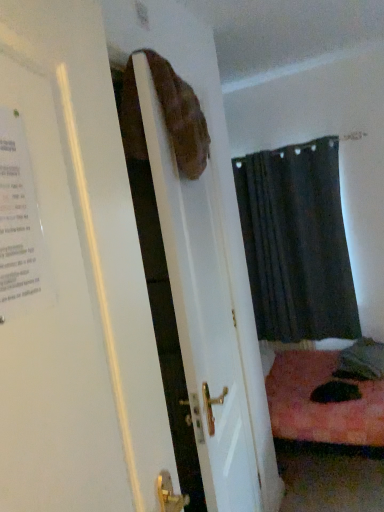
Question: Considering the relative sizes of matte brown bag at upper center and dark fabric curtain at center in the image provided, is matte brown bag at upper center wider than dark fabric curtain at center?

Choices:
 (A) yes
 (B) no

Answer: (B)

Question: Is matte brown bag at upper center positioned with its back to dark fabric curtain at center?

Choices:
 (A) yes
 (B) no

Answer: (B)

Question: From a real-world perspective, is matte brown bag at upper center positioned over dark fabric curtain at center based on gravity?

Choices:
 (A) yes
 (B) no

Answer: (A)

Question: Considering the relative sizes of matte brown bag at upper center and dark fabric curtain at center in the image provided, is matte brown bag at upper center shorter than dark fabric curtain at center?

Choices:
 (A) no
 (B) yes

Answer: (B)

Question: Is matte brown bag at upper center with dark fabric curtain at center?

Choices:
 (A) no
 (B) yes

Answer: (A)

Question: Looking at the image, does matte brown bag at upper center seem bigger or smaller compared to white paper poster at left?

Choices:
 (A) big
 (B) small

Answer: (A)

Question: In the image, is matte brown bag at upper center positioned in front of or behind white paper poster at left?

Choices:
 (A) front
 (B) behind

Answer: (A)

Question: Is matte brown bag at upper center taller or shorter than white paper poster at left?

Choices:
 (A) tall
 (B) short

Answer: (A)

Question: Is point (94, 506) closer or farther from the camera than point (13, 292)?

Choices:
 (A) farther
 (B) closer

Answer: (A)

Question: Visually, is dark fabric curtain at center positioned to the left or to the right of white paper poster at left?

Choices:
 (A) right
 (B) left

Answer: (A)

Question: From their relative heights in the image, would you say dark fabric curtain at center is taller or shorter than white paper poster at left?

Choices:
 (A) short
 (B) tall

Answer: (B)

Question: Considering the positions of dark fabric curtain at center and white paper poster at left in the image, is dark fabric curtain at center bigger or smaller than white paper poster at left?

Choices:
 (A) small
 (B) big

Answer: (B)

Question: Is dark fabric curtain at center inside or outside of white paper poster at left?

Choices:
 (A) outside
 (B) inside

Answer: (A)

Question: Considering the positions of matte brown bag at upper center and dark fabric curtain at center in the image, is matte brown bag at upper center taller or shorter than dark fabric curtain at center?

Choices:
 (A) short
 (B) tall

Answer: (A)

Question: From a real-world perspective, relative to dark fabric curtain at center, is matte brown bag at upper center vertically above or below?

Choices:
 (A) below
 (B) above

Answer: (B)